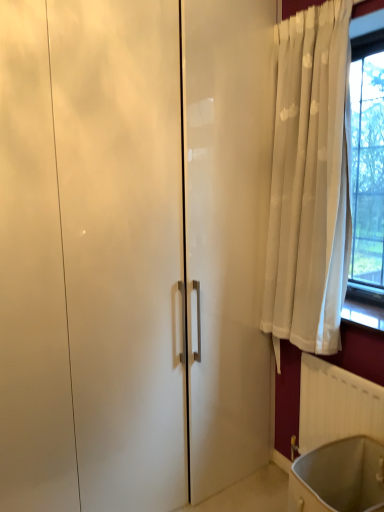
At what (x,y) coordinates should I click in order to perform the action: click on vacant point above white plastic radiator at lower right (from a real-world perspective). Please return your answer as a coordinate pair (x, y). The width and height of the screenshot is (384, 512). Looking at the image, I should click on (338, 365).